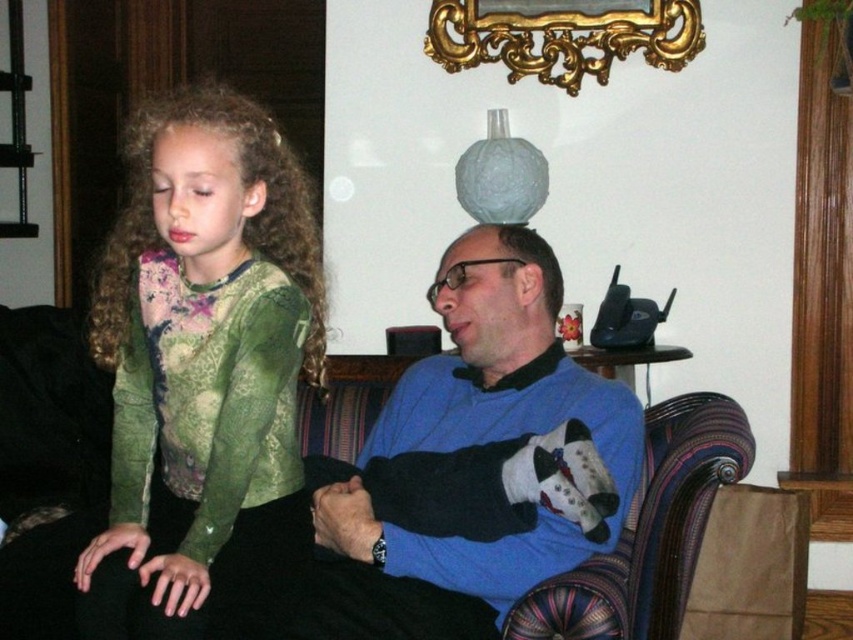
You are a fashion designer observing the image and need to decide which item is larger between the green lace shirt at left and the gold ornate mirror at upper center. Which one is bigger?

The green lace shirt at left is bigger than the gold ornate mirror at upper center according to the description.

You are a photographer trying to capture a portrait of the green lace shirt at left and the gold ornate mirror at upper center. Since you want both subjects to be in focus, you need to know which one is taller. Can you determine which object is taller?

The green lace shirt at left is taller than the gold ornate mirror at upper center, so you should adjust your camera settings to focus on the taller object first.